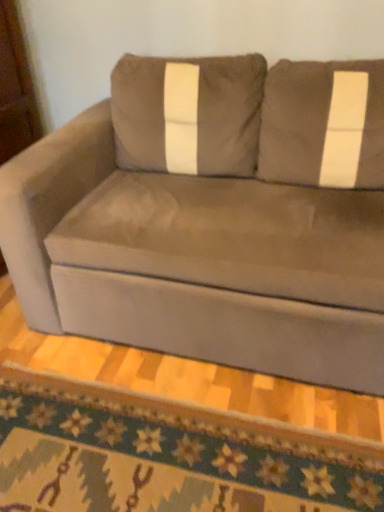
Describe the element at coordinates (212, 217) in the screenshot. This screenshot has width=384, height=512. I see `suede gray couch at center` at that location.

At what (x,y) coordinates should I click in order to perform the action: click on suede gray couch at center. Please return your answer as a coordinate pair (x, y). The height and width of the screenshot is (512, 384). Looking at the image, I should click on (x=212, y=217).

What is the approximate width of suede gray couch at center?

suede gray couch at center is 1.09 meters in width.

Locate an element on the screen. This screenshot has height=512, width=384. suede gray couch at center is located at coordinates (212, 217).